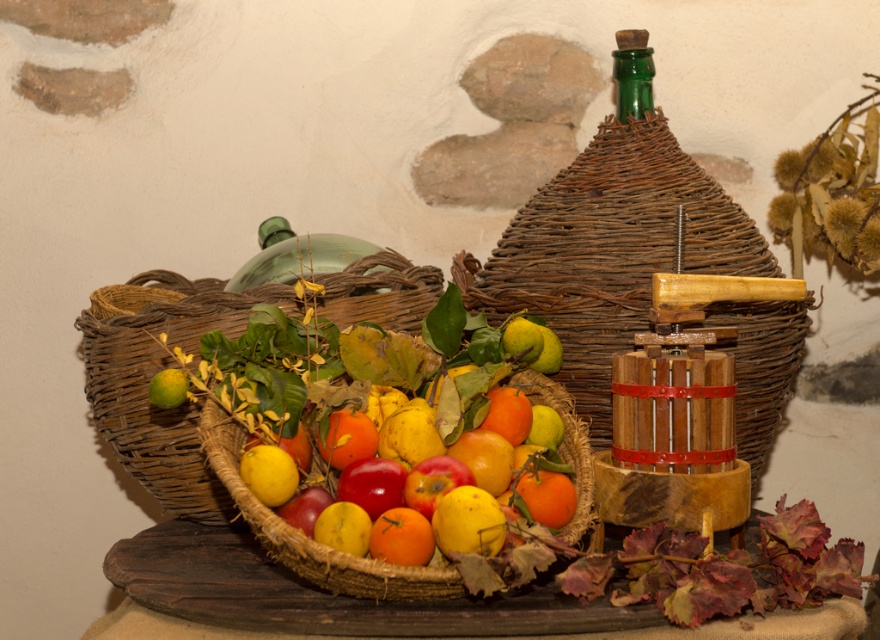
Can you confirm if woven brown basket at center is positioned to the left of glossy orange fruit at center?

Correct, you'll find woven brown basket at center to the left of glossy orange fruit at center.

Does woven brown basket at center have a lesser height compared to glossy orange fruit at center?

No, woven brown basket at center is not shorter than glossy orange fruit at center.

Who is more distant from viewer, (x=160, y=352) or (x=446, y=496)?

The point (x=160, y=352) is more distant.

In order to click on woven brown basket at center in this screenshot , I will do `click(148, 381)`.

Does glossy orange fruit at center have a smaller size compared to yellow matte apple at center?

No.

Which is below, glossy orange fruit at center or yellow matte apple at center?

glossy orange fruit at center is lower down.

Between point (468, 500) and point (268, 488), which one is positioned in front?

Point (468, 500) is in front.

You are a GUI agent. You are given a task and a screenshot of the screen. Output one action in this format:
    pyautogui.click(x=<x>, y=<y>)
    Task: Click on the glossy orange fruit at center
    
    Given the screenshot: What is the action you would take?
    pyautogui.click(x=422, y=506)

Is point (265, 468) positioned behind point (622, 54)?

No.

Measure the distance between point [456,476] and camera.

They are 1.49 meters apart.

Where is `glossy orange fruit at center`? Image resolution: width=880 pixels, height=640 pixels. glossy orange fruit at center is located at coordinates (422, 506).